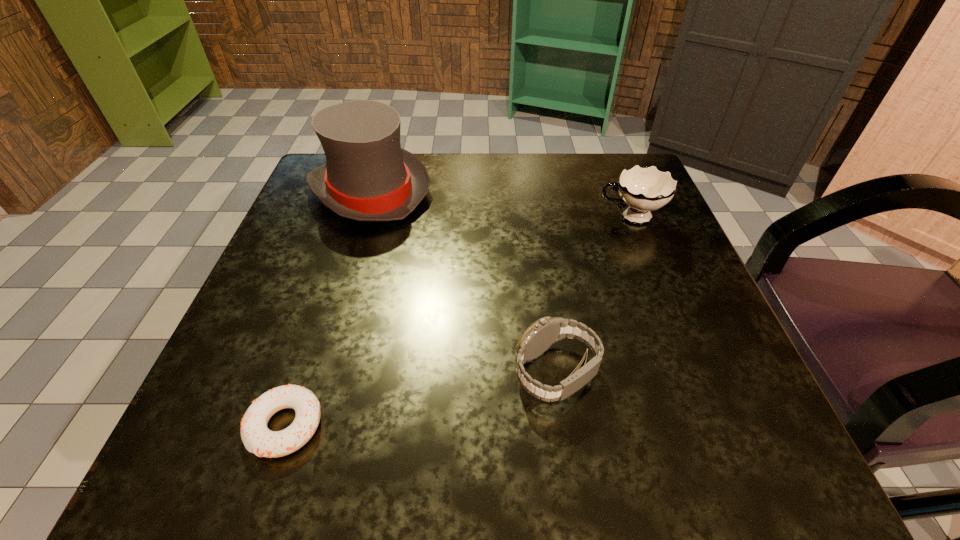
Locate an element on the screen. This screenshot has height=540, width=960. object that is at the near left corner is located at coordinates (257, 438).

Where is `object at the far right corner`? This screenshot has width=960, height=540. object at the far right corner is located at coordinates (644, 189).

Find the location of a particular element. The width and height of the screenshot is (960, 540). free space at the far edge of the desktop is located at coordinates (491, 201).

I want to click on free space at the left edge of the desktop, so click(x=292, y=239).

Locate an element on the screen. This screenshot has height=540, width=960. free region at the right edge of the desktop is located at coordinates (689, 355).

This screenshot has height=540, width=960. In the image, there is a desktop. What are the coordinates of `free space at the far left corner` in the screenshot? It's located at (328, 215).

The image size is (960, 540). In the image, there is a desktop. Find the location of `free region at the near left corner`. free region at the near left corner is located at coordinates (213, 411).

Where is `vacant space at the far right corner`? This screenshot has height=540, width=960. vacant space at the far right corner is located at coordinates (599, 172).

This screenshot has height=540, width=960. In order to click on vacant area between the rightmost object and the shortest object in this screenshot , I will do `click(458, 321)`.

This screenshot has width=960, height=540. Find the location of `vacant area that lies between the rightmost object and the doughnut`. vacant area that lies between the rightmost object and the doughnut is located at coordinates (458, 321).